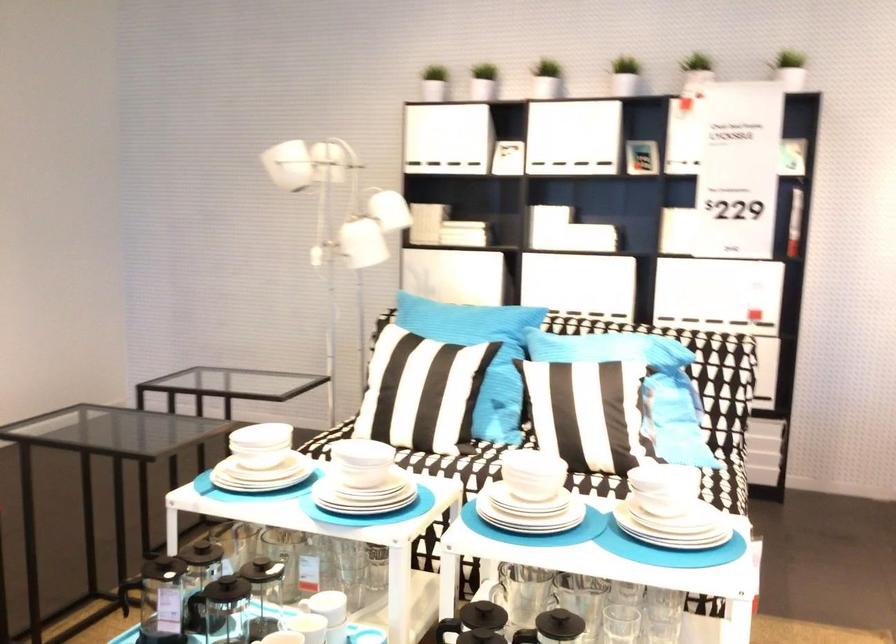
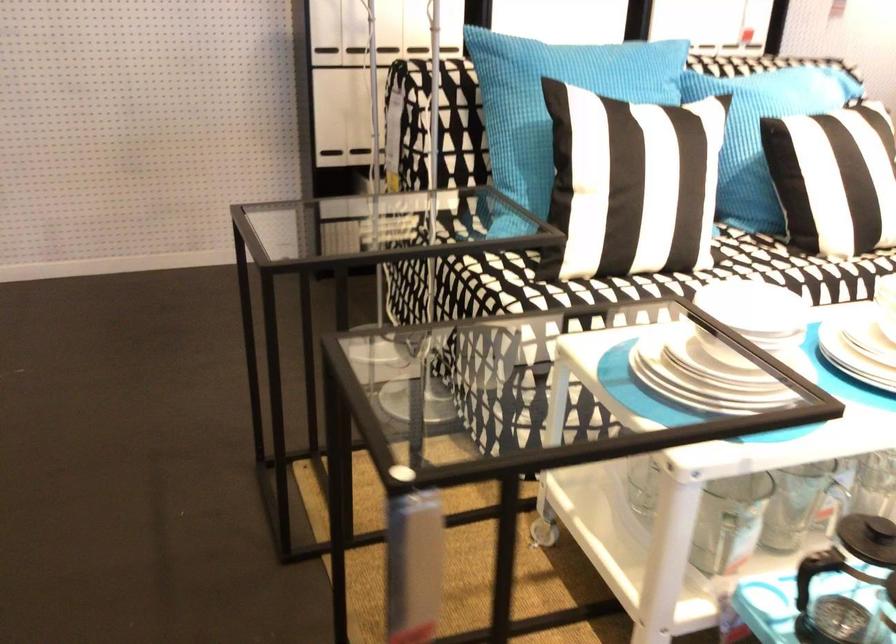
In the second image, find the point that corresponds to [549,404] in the first image.

(833, 178)